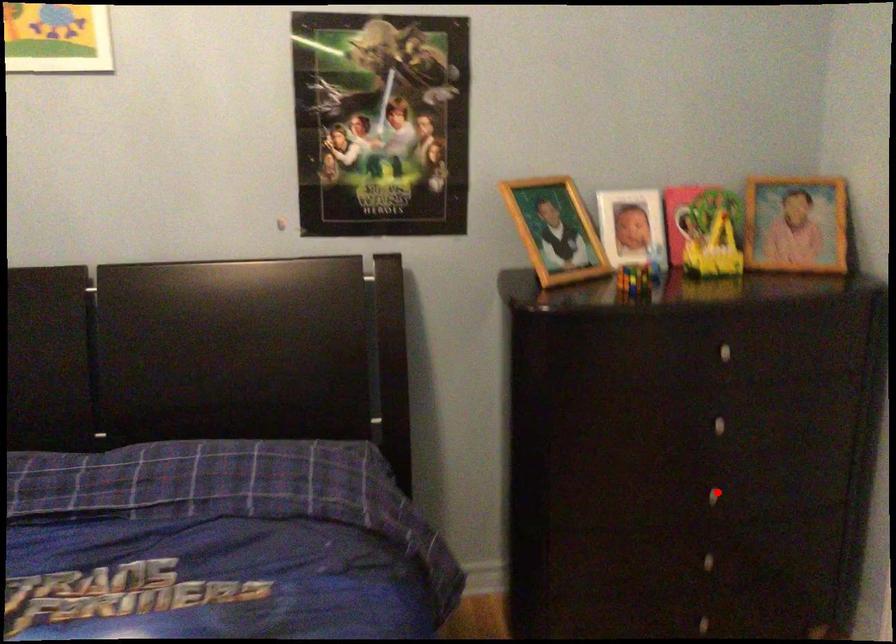
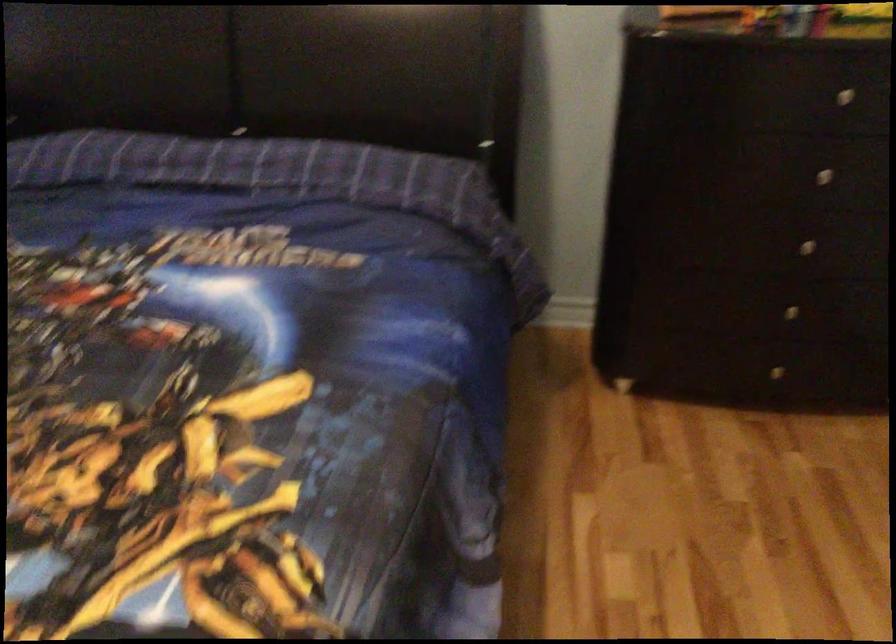
Where in the second image is the point corresponding to the highlighted location from the first image?

(805, 245)